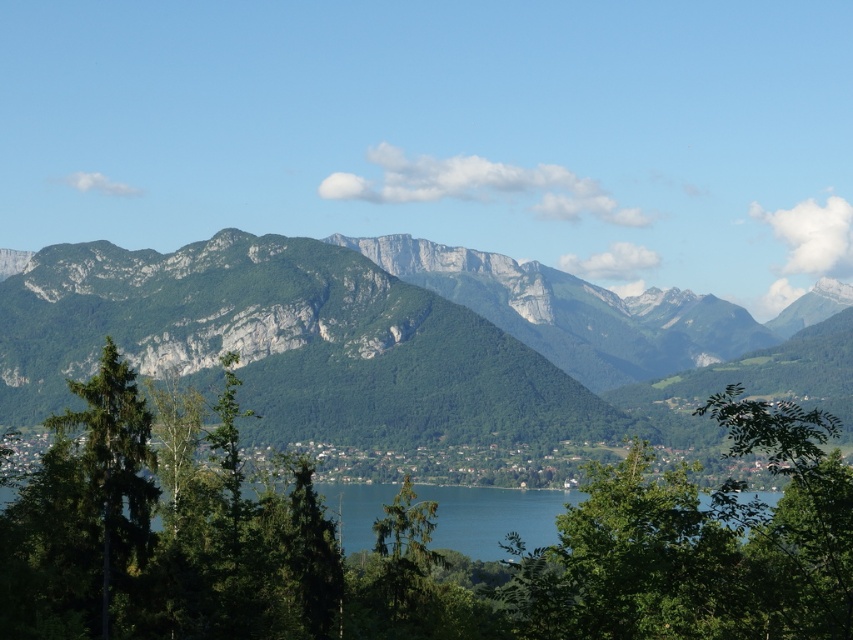
You are standing at the edge of the blue water at center and want to walk to the green leafy tree at center. In which direction should you go?

You should walk to the left to reach the green leafy tree at center because it is to the right of the blue water at center.